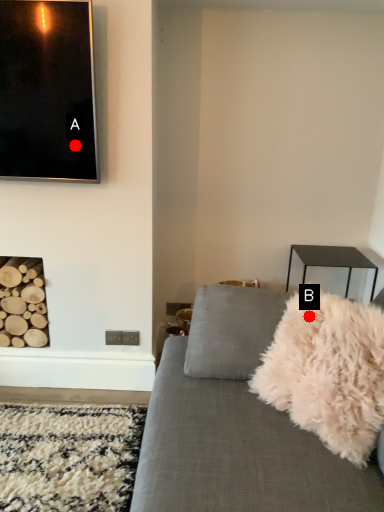
Question: Two points are circled on the image, labeled by A and B beside each circle. Which point is farther to the camera?

Choices:
 (A) A is further
 (B) B is further

Answer: (A)